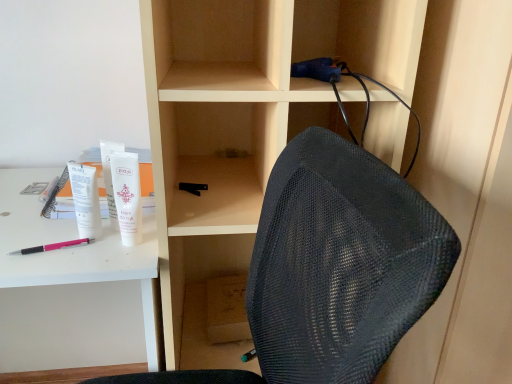
I want to click on vacant area situated to the left side of white matte tube at upper left, so point(52,236).